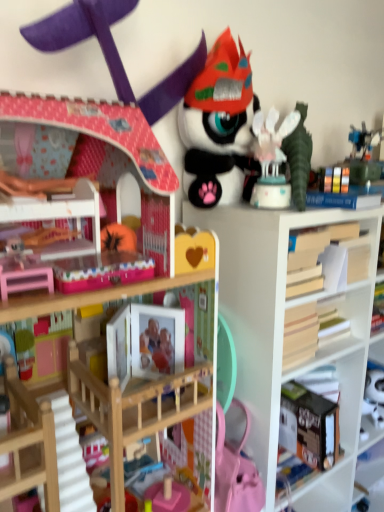
This screenshot has width=384, height=512. What are the coordinates of `matte pink dollhouse at upper left, the first toy from the left` in the screenshot? It's located at (113, 50).

Image resolution: width=384 pixels, height=512 pixels. What do you see at coordinates (113, 50) in the screenshot?
I see `matte pink dollhouse at upper left, the third toy when ordered from right to left` at bounding box center [113, 50].

This screenshot has width=384, height=512. What do you see at coordinates (91, 192) in the screenshot? I see `wooden bookcase at upper left` at bounding box center [91, 192].

Measure the distance between white matte bookshelf at center and camera.

The distance of white matte bookshelf at center from camera is 33.50 inches.

In order to click on matte pink dollhouse at upper left, the third toy when ordered from right to left in this screenshot , I will do `click(113, 50)`.

Is wooden book at right wider or thinner than white matte bookshelf at center?

In the image, wooden book at right appears to be more narrow than white matte bookshelf at center.

At what (x,y) coordinates should I click in order to perform the action: click on book above the white matte bookshelf at center (from a real-world perspective). Please return your answer as a coordinate pair (x, y). Looking at the image, I should click on (313, 255).

Are wooden book at right and white matte bookshelf at center far apart?

No, wooden book at right is not far away from white matte bookshelf at center.

Considering the sizes of objects wooden book at right and white matte bookshelf at center in the image provided, who is shorter, wooden book at right or white matte bookshelf at center?

wooden book at right is shorter.

Do you think matte pink dollhouse at upper left, the first toy from the left, is within white glossy cake at upper right, the first toy viewed from the right, or outside of it?

matte pink dollhouse at upper left, the first toy from the left, is not inside white glossy cake at upper right, the first toy viewed from the right, it's outside.

From a real-world perspective, is matte pink dollhouse at upper left, the third toy when ordered from right to left, physically above white glossy cake at upper right, the first toy viewed from the right?

Yes, from a real-world perspective, matte pink dollhouse at upper left, the third toy when ordered from right to left, is on top of white glossy cake at upper right, the first toy viewed from the right.

From the image's perspective, which is above, matte pink dollhouse at upper left, the third toy when ordered from right to left, or white glossy cake at upper right, the first toy viewed from the right?

matte pink dollhouse at upper left, the third toy when ordered from right to left, from the image's perspective.

From the image's perspective, is white glossy cake at upper right, the first toy viewed from the right, on top of matte pink dollhouse at upper left, the first toy from the left?

No, from the image's perspective, white glossy cake at upper right, the first toy viewed from the right, is not on top of matte pink dollhouse at upper left, the first toy from the left.

Considering the sizes of objects white glossy cake at upper right, the first toy viewed from the right, and matte pink dollhouse at upper left, the third toy when ordered from right to left, in the image provided, who is bigger, white glossy cake at upper right, the first toy viewed from the right, or matte pink dollhouse at upper left, the third toy when ordered from right to left,?

Bigger between the two is matte pink dollhouse at upper left, the third toy when ordered from right to left.

Is white glossy cake at upper right, placed as the 3th toy when sorted from left to right, taller than matte pink dollhouse at upper left, the third toy when ordered from right to left?

No.

Which of these two, matte pink dollhouse at upper left, the first toy from the left, or matte black plush toy at upper center, the second toy in the right-to-left sequence, is wider?

matte black plush toy at upper center, the second toy in the right-to-left sequence, is wider.

Is matte pink dollhouse at upper left, the first toy from the left, completely or partially outside of matte black plush toy at upper center, the 2th toy viewed from the left?

matte pink dollhouse at upper left, the first toy from the left, lies outside matte black plush toy at upper center, the 2th toy viewed from the left,'s area.

From a real-world perspective, is matte pink dollhouse at upper left, the third toy when ordered from right to left, positioned above or below matte black plush toy at upper center, the second toy in the right-to-left sequence?

matte pink dollhouse at upper left, the third toy when ordered from right to left, is situated higher than matte black plush toy at upper center, the second toy in the right-to-left sequence, in the real world.

Which object is closer to the camera taking this photo, matte pink dollhouse at upper left, the third toy when ordered from right to left, or matte black plush toy at upper center, the second toy in the right-to-left sequence?

matte pink dollhouse at upper left, the third toy when ordered from right to left, is in front.

Is white matte bookshelf at center far from matte pink dollhouse at upper left, the first toy from the left?

white matte bookshelf at center is actually quite close to matte pink dollhouse at upper left, the first toy from the left.

Locate an element on the screen. The image size is (384, 512). shelf below the matte pink dollhouse at upper left, the third toy when ordered from right to left (from the image's perspective) is located at coordinates (283, 332).

Considering the positions of objects white matte bookshelf at center and matte pink dollhouse at upper left, the third toy when ordered from right to left, in the image provided, who is more to the left, white matte bookshelf at center or matte pink dollhouse at upper left, the third toy when ordered from right to left,?

matte pink dollhouse at upper left, the third toy when ordered from right to left.

Who is more distant, wooden bookcase at upper left or white glossy cake at upper right, placed as the 3th toy when sorted from left to right?

white glossy cake at upper right, placed as the 3th toy when sorted from left to right, is further from the camera.

Looking at their sizes, would you say wooden bookcase at upper left is wider or thinner than white glossy cake at upper right, placed as the 3th toy when sorted from left to right?

In the image, wooden bookcase at upper left appears to be wider than white glossy cake at upper right, placed as the 3th toy when sorted from left to right.

Can you confirm if wooden bookcase at upper left is positioned to the left of white glossy cake at upper right, the first toy viewed from the right?

Yes, wooden bookcase at upper left is to the left of white glossy cake at upper right, the first toy viewed from the right.

Consider the image. From a real-world perspective, is wooden bookcase at upper left physically above white glossy cake at upper right, the first toy viewed from the right?

No, from a real-world perspective, wooden bookcase at upper left is not on top of white glossy cake at upper right, the first toy viewed from the right.

From their relative heights in the image, would you say matte black plush toy at upper center, the second toy in the right-to-left sequence, is taller or shorter than white matte bookshelf at center?

In the image, matte black plush toy at upper center, the second toy in the right-to-left sequence, appears to be shorter than white matte bookshelf at center.

Looking at the image, does matte black plush toy at upper center, the 2th toy viewed from the left, seem bigger or smaller compared to white matte bookshelf at center?

In the image, matte black plush toy at upper center, the 2th toy viewed from the left, appears to be smaller than white matte bookshelf at center.

In the image, is matte black plush toy at upper center, the second toy in the right-to-left sequence, on the left side or the right side of white matte bookshelf at center?

matte black plush toy at upper center, the second toy in the right-to-left sequence, is to the left of white matte bookshelf at center.

Is matte black plush toy at upper center, the 2th toy viewed from the left, wider than white matte bookshelf at center?

In fact, matte black plush toy at upper center, the 2th toy viewed from the left, might be narrower than white matte bookshelf at center.

Image resolution: width=384 pixels, height=512 pixels. In order to click on shelf below the wooden book at right (from a real-world perspective) in this screenshot , I will do `click(283, 332)`.

From the white glossy cake at upper right, the first toy viewed from the right, count the 2nd toy to the left and point to it. Please provide its 2D coordinates.

[(113, 50)]

Estimate the real-world distances between objects in this image. Which object is further from wooden book at right, matte pink dollhouse at upper left, the first toy from the left, or wooden bookcase at upper left?

The object further to wooden book at right is matte pink dollhouse at upper left, the first toy from the left.

In the scene shown: Based on their spatial positions, is wooden book at right or matte black plush toy at upper center, the 2th toy viewed from the left, further from matte pink dollhouse at upper left, the third toy when ordered from right to left?

wooden book at right lies further to matte pink dollhouse at upper left, the third toy when ordered from right to left, than the other object.

Estimate the real-world distances between objects in this image. Which object is further from matte black plush toy at upper center, the second toy in the right-to-left sequence, white glossy cake at upper right, placed as the 3th toy when sorted from left to right, or matte pink dollhouse at upper left, the first toy from the left?

matte pink dollhouse at upper left, the first toy from the left.

Based on their spatial positions, is white glossy cake at upper right, the first toy viewed from the right, or white matte bookshelf at center further from matte black plush toy at upper center, the 2th toy viewed from the left?

white matte bookshelf at center is further to matte black plush toy at upper center, the 2th toy viewed from the left.

Considering their positions, is white matte bookshelf at center positioned further to white glossy cake at upper right, the first toy viewed from the right, than wooden bookcase at upper left?

wooden bookcase at upper left is positioned further to the anchor white glossy cake at upper right, the first toy viewed from the right.

From the image, which object appears to be farther from wooden bookcase at upper left, wooden book at right or matte black plush toy at upper center, the 2th toy viewed from the left?

Based on the image, wooden book at right appears to be further to wooden bookcase at upper left.

Estimate the real-world distances between objects in this image. Which object is closer to wooden book at right, white glossy cake at upper right, placed as the 3th toy when sorted from left to right, or white matte bookshelf at center?

Based on the image, white matte bookshelf at center appears to be nearer to wooden book at right.

From the image, which object appears to be nearer to white matte bookshelf at center, matte black plush toy at upper center, the second toy in the right-to-left sequence, or wooden bookcase at upper left?

Based on the image, matte black plush toy at upper center, the second toy in the right-to-left sequence, appears to be nearer to white matte bookshelf at center.

You are a GUI agent. You are given a task and a screenshot of the screen. Output one action in this format:
    pyautogui.click(x=<x>, y=<y>)
    Task: Click on the book between wooden bookcase at upper left and white matte bookshelf at center in the horizontal direction
    Image resolution: width=384 pixels, height=512 pixels.
    Given the screenshot: What is the action you would take?
    pyautogui.click(x=313, y=255)

Where is `toy between matte black plush toy at upper center, the second toy in the right-to-left sequence, and wooden bookcase at upper left, in the vertical direction`? toy between matte black plush toy at upper center, the second toy in the right-to-left sequence, and wooden bookcase at upper left, in the vertical direction is located at coordinates (270, 160).

Locate an element on the screen. This screenshot has width=384, height=512. book that lies between white glossy cake at upper right, the first toy viewed from the right, and white matte bookshelf at center from top to bottom is located at coordinates (313, 255).

The height and width of the screenshot is (512, 384). I want to click on bookcase between matte pink dollhouse at upper left, the third toy when ordered from right to left, and white matte bookshelf at center in the up-down direction, so (91, 192).